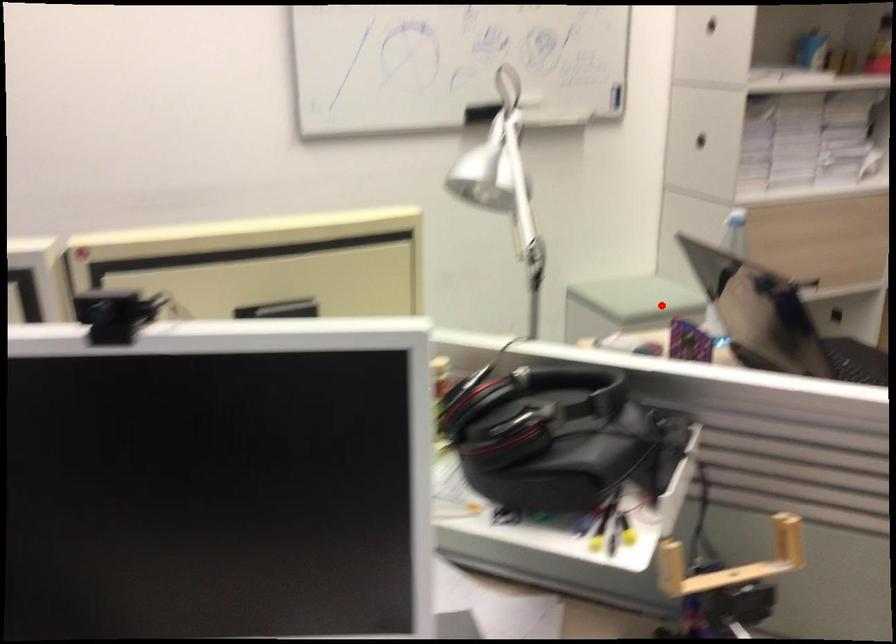
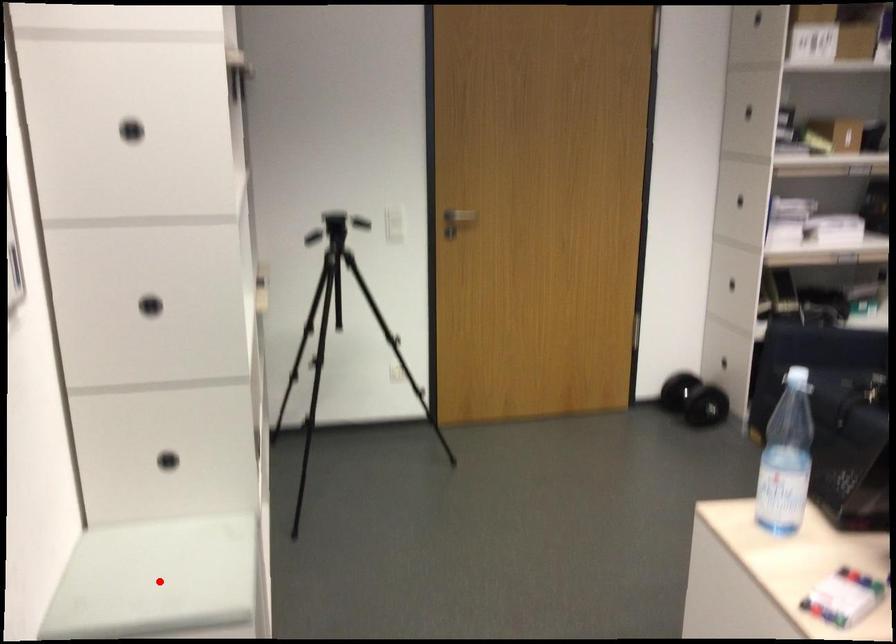
I am providing you with two images of the same scene from different viewpoints. A red point is marked on the first image and another point is marked on the second image. Does the point marked in image1 correspond to the same location as the one in image2?

Yes